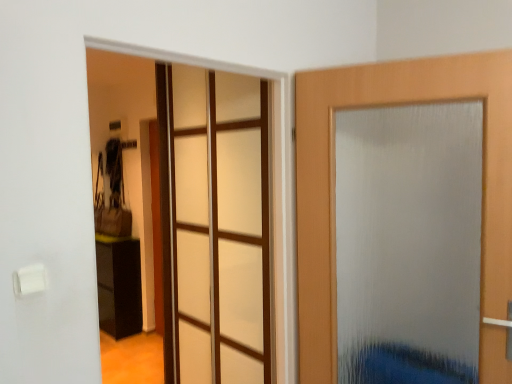
Question: Is transparent glass door at center next to frosted glass door at right?

Choices:
 (A) yes
 (B) no

Answer: (B)

Question: Is transparent glass door at center not close to frosted glass door at right?

Choices:
 (A) no
 (B) yes

Answer: (A)

Question: From a real-world perspective, is transparent glass door at center positioned under frosted glass door at right based on gravity?

Choices:
 (A) yes
 (B) no

Answer: (A)

Question: Is transparent glass door at center to the left of frosted glass door at right from the viewer's perspective?

Choices:
 (A) no
 (B) yes

Answer: (B)

Question: Could you tell me if transparent glass door at center is turned towards frosted glass door at right?

Choices:
 (A) no
 (B) yes

Answer: (A)

Question: Is the depth of transparent glass door at center less than that of frosted glass door at right?

Choices:
 (A) yes
 (B) no

Answer: (B)

Question: Is frosted glass door at right oriented away from transparent glass door at center?

Choices:
 (A) yes
 (B) no

Answer: (B)

Question: From the image's perspective, would you say frosted glass door at right is shown under transparent glass door at center?

Choices:
 (A) no
 (B) yes

Answer: (A)

Question: Does frosted glass door at right have a lesser height compared to transparent glass door at center?

Choices:
 (A) yes
 (B) no

Answer: (A)

Question: Does frosted glass door at right come in front of transparent glass door at center?

Choices:
 (A) no
 (B) yes

Answer: (B)

Question: Considering the relative sizes of frosted glass door at right and transparent glass door at center in the image provided, is frosted glass door at right taller than transparent glass door at center?

Choices:
 (A) no
 (B) yes

Answer: (A)

Question: Is frosted glass door at right thinner than transparent glass door at center?

Choices:
 (A) no
 (B) yes

Answer: (A)

Question: Is the depth of black glossy cabinet at lower left greater than that of frosted glass door at right?

Choices:
 (A) no
 (B) yes

Answer: (B)